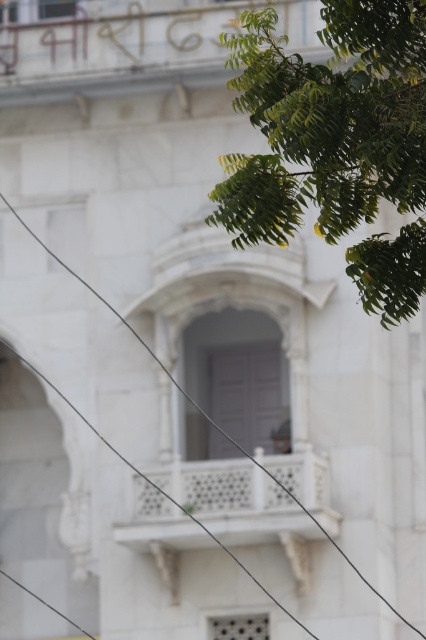
You are standing at the base of the building depicted in the image and want to take a photo of the green leafy tree at upper right. The camera you are using has a maximum focus range of 30 feet. Will the camera be able to focus on the tree?

The distance between the green leafy tree at upper right and the camera is 33.63 feet, which exceeds the camera maximum focus range of 30 feet. Therefore, the camera will not be able to focus on the tree.

You are an architect examining this building. You notice the green leafy tree at upper right and the black wire at upper left in the image. Which object appears larger in the scene?

The black wire at upper left appears larger than the green leafy tree at upper right.